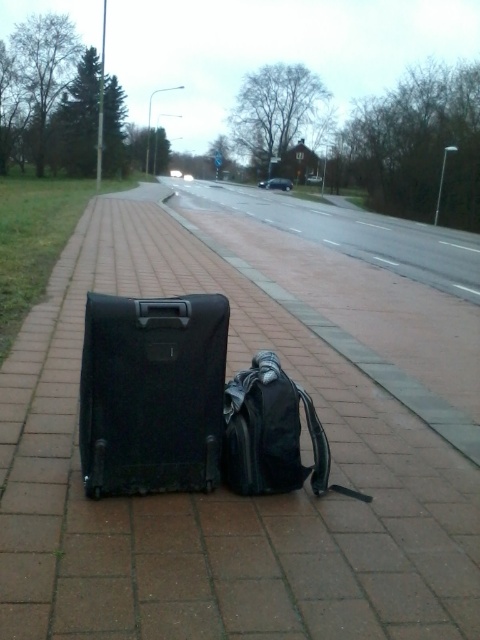
From the picture: Who is lower down, matte black backpack at center or black matte suitcase at left?

matte black backpack at center is lower down.

Can you confirm if matte black backpack at center is positioned to the right of black matte suitcase at left?

In fact, matte black backpack at center is to the left of black matte suitcase at left.

This screenshot has width=480, height=640. In order to click on matte black backpack at center in this screenshot , I will do `click(272, 433)`.

Which of these two, black plastic suitcase at center or black matte suitcase at center, stands taller?

With more height is black plastic suitcase at center.

Which is more to the right, black plastic suitcase at center or black matte suitcase at center?

Positioned to the right is black plastic suitcase at center.

Consider the image. Who is more distant from viewer, (380, 524) or (192, 428)?

Positioned behind is point (380, 524).

Find the location of a particular element. This screenshot has height=640, width=480. black plastic suitcase at center is located at coordinates (224, 490).

Is point (447, 424) farther from camera compared to point (268, 292)?

No, (447, 424) is closer to viewer.

The height and width of the screenshot is (640, 480). Identify the location of black plastic suitcase at center. (224, 490).